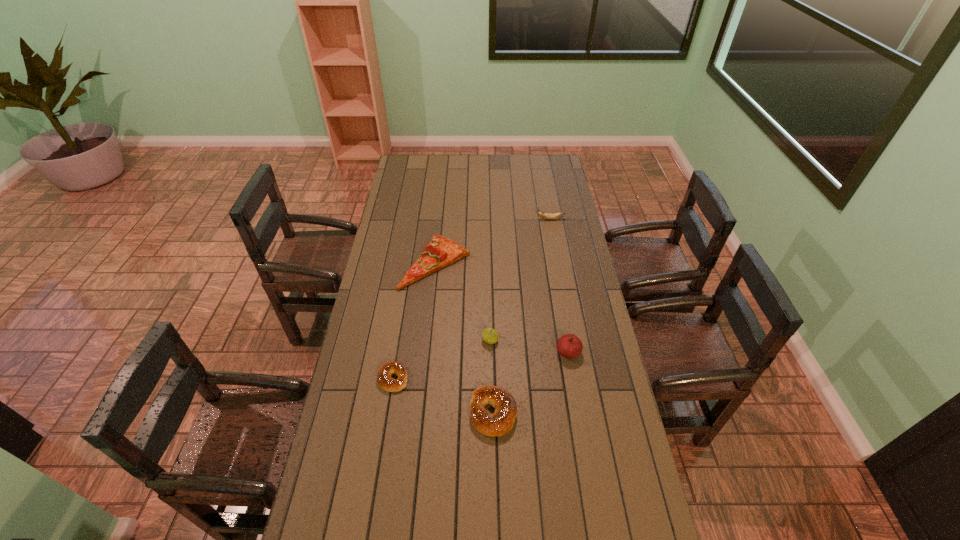
Locate an element on the screen. tomato at the right edge is located at coordinates (570, 346).

In order to click on free space at the far edge in this screenshot , I will do `click(503, 173)`.

In the image, there is a desktop. At what (x,y) coordinates should I click in order to perform the action: click on vacant space at the left edge. Please return your answer as a coordinate pair (x, y). Looking at the image, I should click on (375, 342).

Locate an element on the screen. free region at the right edge of the desktop is located at coordinates (566, 215).

I want to click on free space at the near right corner, so click(x=630, y=515).

Identify the location of empty location between the banana and the left bagel. The width and height of the screenshot is (960, 540). (471, 299).

Identify the location of empty space that is in between the tomato and the left bagel. Image resolution: width=960 pixels, height=540 pixels. (480, 365).

I want to click on free spot between the pear and the pizza, so click(x=463, y=301).

Where is `vacant space in between the fifth nearest object and the banana`? This screenshot has width=960, height=540. vacant space in between the fifth nearest object and the banana is located at coordinates (493, 241).

The width and height of the screenshot is (960, 540). Identify the location of empty space between the pear and the third shortest object. (492, 376).